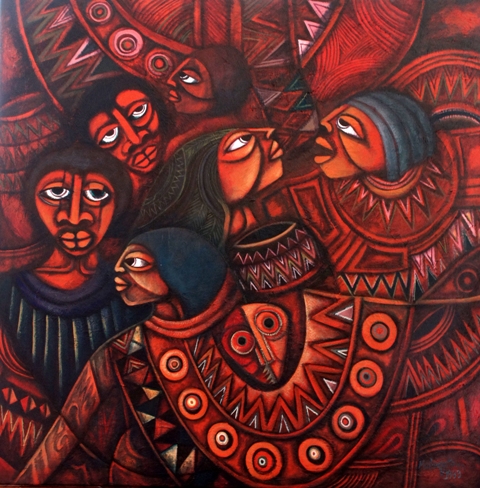
In order to click on chest in this screenshot , I will do `click(43, 332)`.